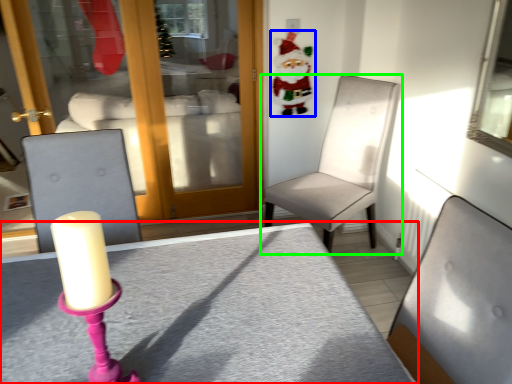
Question: Which object is the closest to the table (highlighted by a red box)? Choose among these: santa claus (highlighted by a blue box) or chair (highlighted by a green box).

Choices:
 (A) santa claus
 (B) chair

Answer: (B)